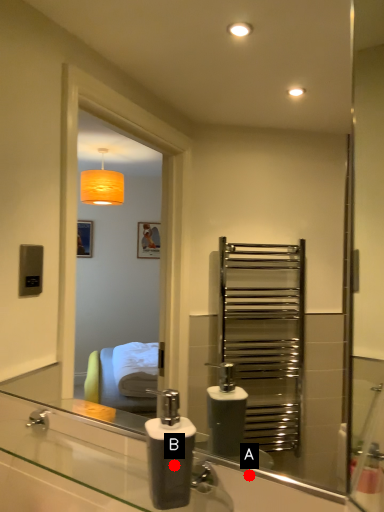
Question: Two points are circled on the image, labeled by A and B beside each circle. Among these points, which one is nearest to the camera?

Choices:
 (A) A is closer
 (B) B is closer

Answer: (B)